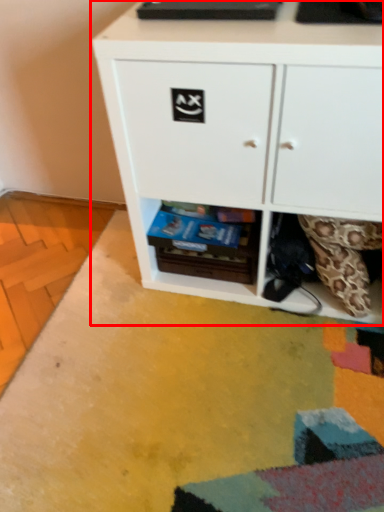
Question: In this image, where is chest of drawers (annotated by the red box) located relative to shelf?

Choices:
 (A) right
 (B) left

Answer: (A)